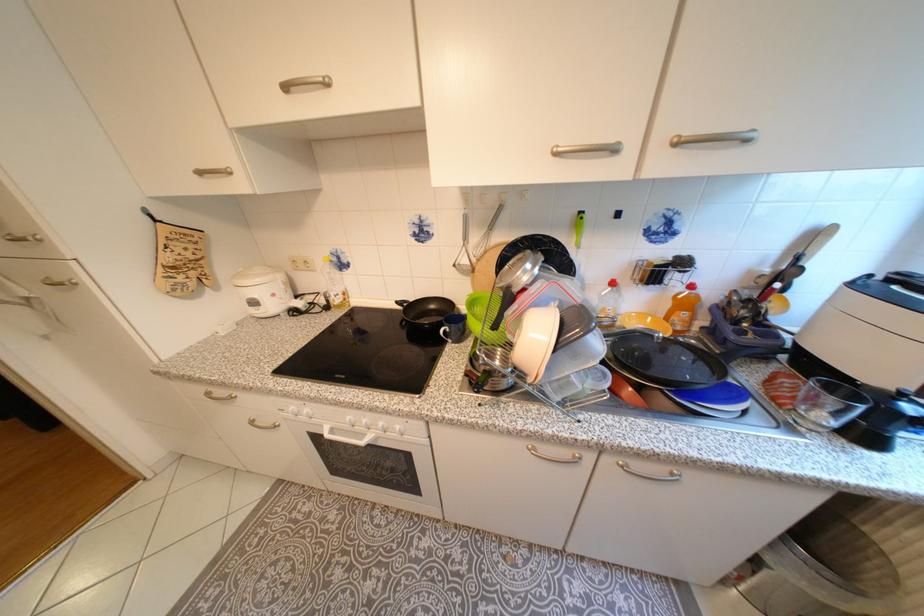
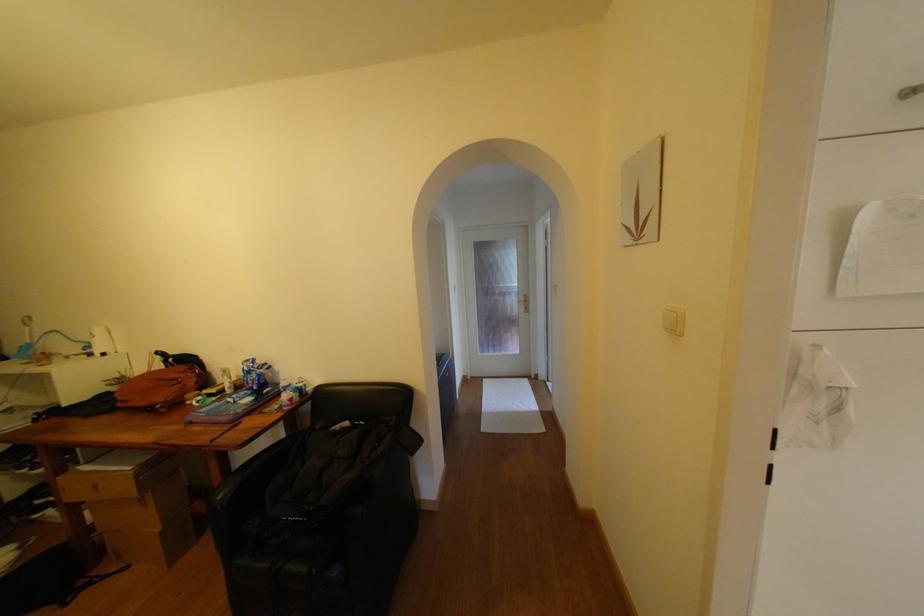
Question: What movement of the cameraman would produce the second image?

Choices:
 (A) Left
 (B) Right
 (C) Forward
 (D) Backward

Answer: (A)